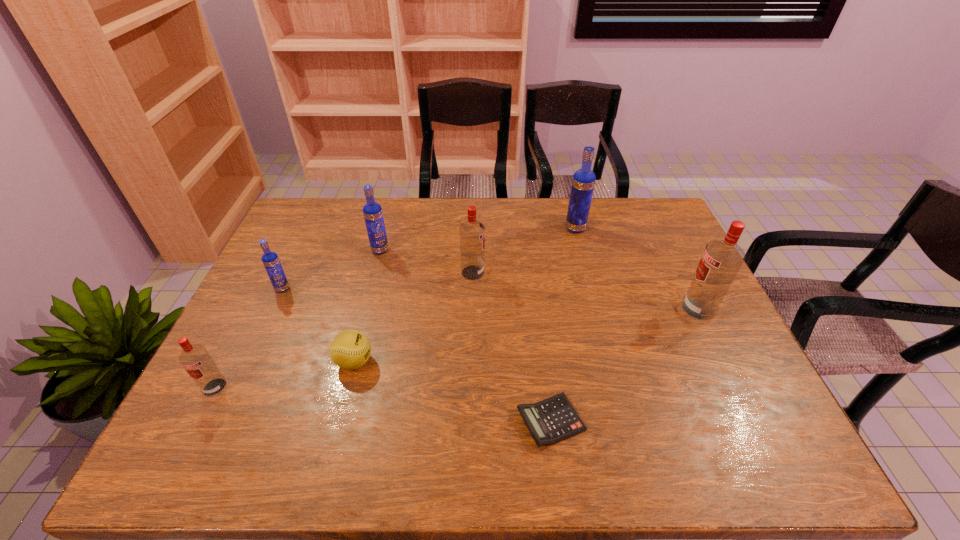
Identify the location of vacant space that's between the rightmost object and the nearest vodka. (457, 348).

Where is `free space between the fifth nearest vodka and the third object from right to left`? free space between the fifth nearest vodka and the third object from right to left is located at coordinates (466, 336).

The image size is (960, 540). In order to click on unoccupied area between the seventh tallest object and the calculator in this screenshot , I will do `click(452, 392)`.

You are a GUI agent. You are given a task and a screenshot of the screen. Output one action in this format:
    pyautogui.click(x=<x>, y=<y>)
    Task: Click on the blank region between the fourth vodka from right to left and the second farthest red vodka
    The image size is (960, 540).
    Given the screenshot: What is the action you would take?
    pyautogui.click(x=540, y=280)

Identify which object is the second closest to the smallest red vodka. Please provide its 2D coordinates. Your answer should be formatted as a tuple, i.e. [(x, y)], where the tuple contains the x and y coordinates of a point satisfying the conditions above.

[(271, 262)]

Locate an element on the screen. This screenshot has width=960, height=540. object that is the second closest to the softball is located at coordinates (271, 262).

Where is `vodka object that ranks as the closest to the fifth nearest vodka`? vodka object that ranks as the closest to the fifth nearest vodka is located at coordinates (472, 232).

Locate which vodka ranks third in proximity to the fifth farthest object. Please provide its 2D coordinates. Your answer should be formatted as a tuple, i.e. [(x, y)], where the tuple contains the x and y coordinates of a point satisfying the conditions above.

[(372, 211)]

Choose which blue vodka is the third nearest neighbor to the third vodka from right to left. Please provide its 2D coordinates. Your answer should be formatted as a tuple, i.e. [(x, y)], where the tuple contains the x and y coordinates of a point satisfying the conditions above.

[(271, 262)]

Identify which blue vodka is the second nearest to the rightmost vodka. Please provide its 2D coordinates. Your answer should be formatted as a tuple, i.e. [(x, y)], where the tuple contains the x and y coordinates of a point satisfying the conditions above.

[(372, 211)]